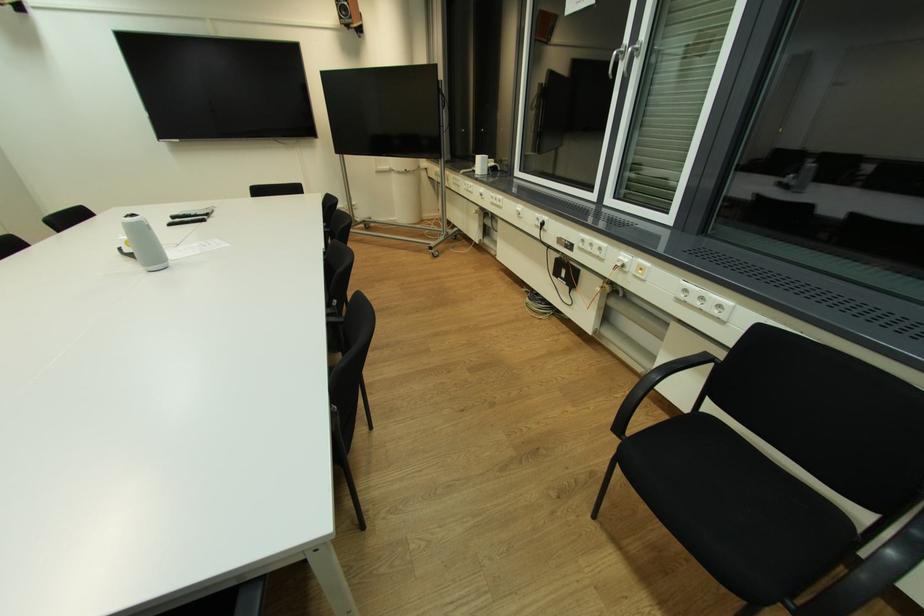
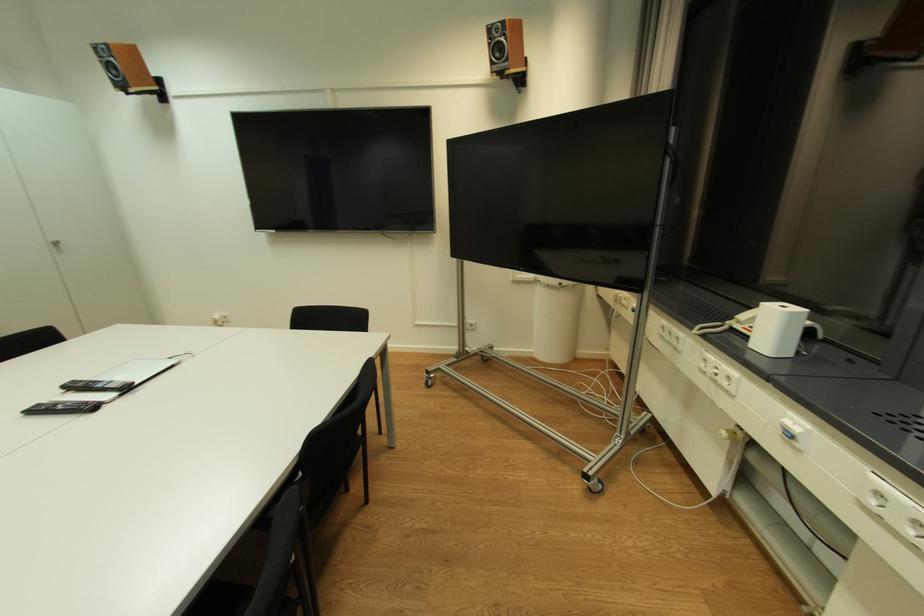
The point at [176,225] is marked in the first image. Where is the corresponding point in the second image?

(43, 411)